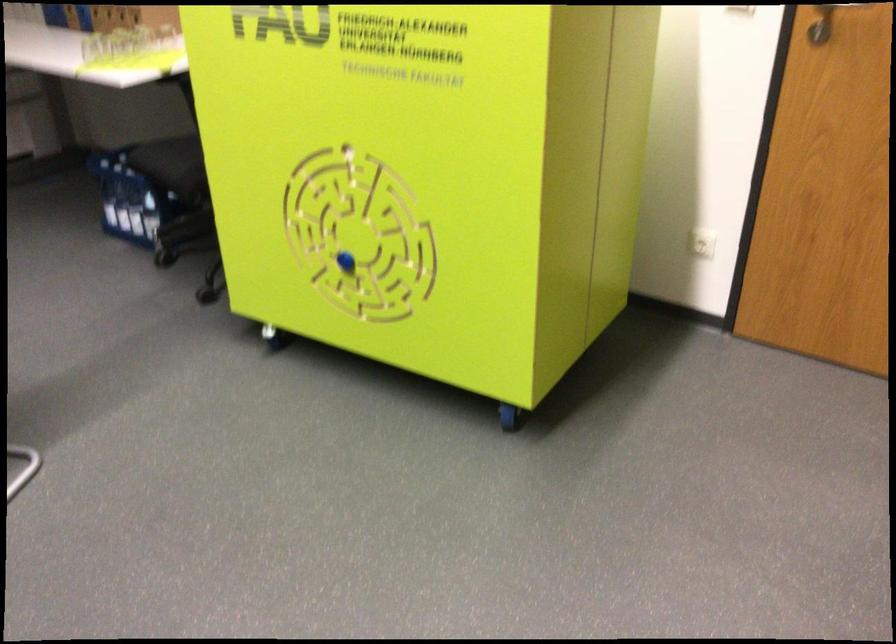
Find the location of `wall power outlet`. wall power outlet is located at coordinates (702, 243).